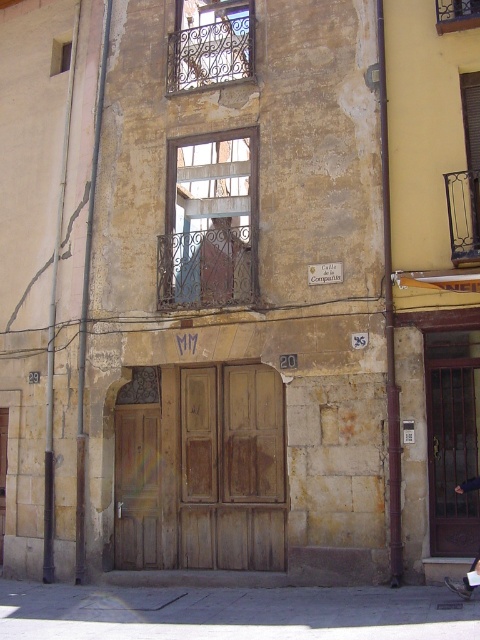
Question: Which object is closer to the camera taking this photo?

Choices:
 (A) wrought iron window at upper center
 (B) metallic wire mesh window at upper center
 (C) wooden door at center

Answer: (B)

Question: Which of the following is the closest to the observer?

Choices:
 (A) (175, 38)
 (B) (468, 214)
 (C) (453, 8)

Answer: (B)

Question: Can you confirm if rusty metal window at center is positioned below matte metal window at upper left?

Choices:
 (A) yes
 (B) no

Answer: (A)

Question: Which point is farther to the camera?

Choices:
 (A) (70, 60)
 (B) (230, 154)

Answer: (A)

Question: Does rusty metal window at center appear over metallic wire mesh window at upper center?

Choices:
 (A) yes
 (B) no

Answer: (B)

Question: From the image, what is the correct spatial relationship of metallic wire mesh window at upper center in relation to matte metal window at upper left?

Choices:
 (A) left
 (B) right

Answer: (B)